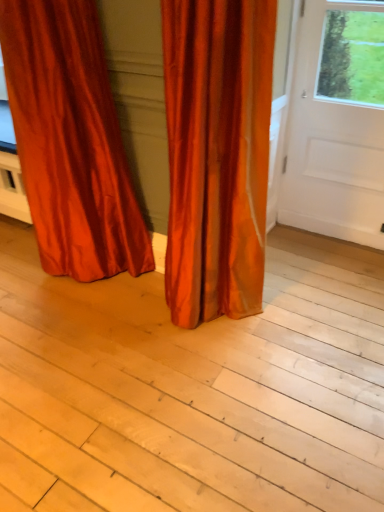
Identify the location of satin orange curtain at lower left, which ranks as the 1th curtain in left-to-right order. (71, 141).

What do you see at coordinates (191, 390) in the screenshot? The width and height of the screenshot is (384, 512). I see `light wood plank at center` at bounding box center [191, 390].

The height and width of the screenshot is (512, 384). What do you see at coordinates (217, 154) in the screenshot? I see `satin orange curtain at center, which is the 2th curtain from left to right` at bounding box center [217, 154].

I want to click on satin orange curtain at lower left, which appears as the 2th curtain when viewed from the right, so click(x=71, y=141).

Would you consider white smooth door at right to be distant from satin orange curtain at center, which is the 2th curtain from left to right?

white smooth door at right is actually quite close to satin orange curtain at center, which is the 2th curtain from left to right.

Is white smooth door at right facing away from satin orange curtain at center, which is the 2th curtain from left to right?

No, white smooth door at right is not facing away from satin orange curtain at center, which is the 2th curtain from left to right.

From the image's perspective, who appears lower, white smooth door at right or satin orange curtain at center, which is the 2th curtain from left to right?

From the image's view, satin orange curtain at center, which is the 2th curtain from left to right, is below.

Does point (280, 209) appear closer or farther from the camera than point (245, 105)?

Point (280, 209) is farther from the camera than point (245, 105).

From the image's perspective, would you say light wood plank at center is positioned over white smooth door at right?

Incorrect, from the image's perspective, light wood plank at center is lower than white smooth door at right.

Is point (5, 454) closer to viewer compared to point (372, 208)?

Yes, point (5, 454) is closer to viewer.

Who is bigger, light wood plank at center or white smooth door at right?

light wood plank at center is bigger.

Can you confirm if light wood plank at center is positioned to the right of white smooth door at right?

In fact, light wood plank at center is to the left of white smooth door at right.

Is satin orange curtain at center, the first curtain viewed from the right, looking in the opposite direction of satin orange curtain at lower left, which ranks as the 1th curtain in left-to-right order?

No, satin orange curtain at center, the first curtain viewed from the right, is not facing the opposite direction of satin orange curtain at lower left, which ranks as the 1th curtain in left-to-right order.

Which is nearer, (x=210, y=2) or (x=27, y=37)?

Point (x=210, y=2)

Identify the location of curtain below the satin orange curtain at lower left, which appears as the 2th curtain when viewed from the right (from a real-world perspective). (217, 154).

Measure the distance between light wood plank at center and satin orange curtain at lower left, which ranks as the 1th curtain in left-to-right order.

light wood plank at center is 26.49 inches from satin orange curtain at lower left, which ranks as the 1th curtain in left-to-right order.

Relative to satin orange curtain at lower left, which appears as the 2th curtain when viewed from the right, is light wood plank at center in front or behind?

In the image, light wood plank at center appears in front of satin orange curtain at lower left, which appears as the 2th curtain when viewed from the right.

From a real-world perspective, who is located lower, light wood plank at center or satin orange curtain at lower left, which ranks as the 1th curtain in left-to-right order?

Answer: light wood plank at center, from a real-world perspective.

Is point (328, 276) closer or farther from the camera than point (81, 9)?

Point (328, 276) appears to be farther away from the viewer than point (81, 9).

Considering the sizes of objects white smooth door at right and satin orange curtain at lower left, which appears as the 2th curtain when viewed from the right, in the image provided, who is shorter, white smooth door at right or satin orange curtain at lower left, which appears as the 2th curtain when viewed from the right,?

Standing shorter between the two is white smooth door at right.

Is white smooth door at right turned away from satin orange curtain at lower left, which appears as the 2th curtain when viewed from the right?

No, white smooth door at right is not facing the opposite direction of satin orange curtain at lower left, which appears as the 2th curtain when viewed from the right.

Does white smooth door at right lie in front of satin orange curtain at lower left, which ranks as the 1th curtain in left-to-right order?

No, white smooth door at right is further to the viewer.

Is white smooth door at right bigger or smaller than satin orange curtain at lower left, which appears as the 2th curtain when viewed from the right?

Considering their sizes, white smooth door at right takes up less space than satin orange curtain at lower left, which appears as the 2th curtain when viewed from the right.

Which object is positioned more to the right, satin orange curtain at lower left, which appears as the 2th curtain when viewed from the right, or satin orange curtain at center, which is the 2th curtain from left to right?

satin orange curtain at center, which is the 2th curtain from left to right, is more to the right.

Considering the sizes of satin orange curtain at lower left, which ranks as the 1th curtain in left-to-right order, and satin orange curtain at center, which is the 2th curtain from left to right, in the image, is satin orange curtain at lower left, which ranks as the 1th curtain in left-to-right order, wider or thinner than satin orange curtain at center, which is the 2th curtain from left to right,?

Clearly, satin orange curtain at lower left, which ranks as the 1th curtain in left-to-right order, has more width compared to satin orange curtain at center, which is the 2th curtain from left to right.

From the image's perspective, is satin orange curtain at lower left, which appears as the 2th curtain when viewed from the right, below satin orange curtain at center, the first curtain viewed from the right?

Incorrect, from the image's perspective, satin orange curtain at lower left, which appears as the 2th curtain when viewed from the right, is higher than satin orange curtain at center, the first curtain viewed from the right.

Can you confirm if satin orange curtain at lower left, which appears as the 2th curtain when viewed from the right, is thinner than light wood plank at center?

Yes, satin orange curtain at lower left, which appears as the 2th curtain when viewed from the right, is thinner than light wood plank at center.

Is satin orange curtain at lower left, which appears as the 2th curtain when viewed from the right, positioned with its back to light wood plank at center?

No, satin orange curtain at lower left, which appears as the 2th curtain when viewed from the right, is not facing the opposite direction of light wood plank at center.

Is satin orange curtain at lower left, which appears as the 2th curtain when viewed from the right, not within light wood plank at center?

satin orange curtain at lower left, which appears as the 2th curtain when viewed from the right, lies outside light wood plank at center's area.

The height and width of the screenshot is (512, 384). In order to click on door behind the satin orange curtain at center, the first curtain viewed from the right in this screenshot , I will do `click(337, 123)`.

Locate an element on the screen. This screenshot has width=384, height=512. door above the light wood plank at center (from a real-world perspective) is located at coordinates (337, 123).

When comparing their distances from satin orange curtain at lower left, which appears as the 2th curtain when viewed from the right, does light wood plank at center or white smooth door at right seem further?

white smooth door at right.

Estimate the real-world distances between objects in this image. Which object is closer to white smooth door at right, light wood plank at center or satin orange curtain at lower left, which ranks as the 1th curtain in left-to-right order?

Based on the image, light wood plank at center appears to be nearer to white smooth door at right.

When comparing their distances from satin orange curtain at center, the first curtain viewed from the right, does light wood plank at center or white smooth door at right seem further?

Based on the image, white smooth door at right appears to be further to satin orange curtain at center, the first curtain viewed from the right.

Which object lies further to the anchor point satin orange curtain at center, the first curtain viewed from the right, satin orange curtain at lower left, which appears as the 2th curtain when viewed from the right, or light wood plank at center?

Based on the image, light wood plank at center appears to be further to satin orange curtain at center, the first curtain viewed from the right.

Estimate the real-world distances between objects in this image. Which object is further from satin orange curtain at lower left, which appears as the 2th curtain when viewed from the right, satin orange curtain at center, which is the 2th curtain from left to right, or light wood plank at center?

Among the two, light wood plank at center is located further to satin orange curtain at lower left, which appears as the 2th curtain when viewed from the right.

Based on their spatial positions, is white smooth door at right or light wood plank at center closer to satin orange curtain at lower left, which ranks as the 1th curtain in left-to-right order?

light wood plank at center is closer to satin orange curtain at lower left, which ranks as the 1th curtain in left-to-right order.

When comparing their distances from white smooth door at right, does satin orange curtain at lower left, which appears as the 2th curtain when viewed from the right, or light wood plank at center seem further?

satin orange curtain at lower left, which appears as the 2th curtain when viewed from the right, is further to white smooth door at right.

Considering their positions, is satin orange curtain at center, the first curtain viewed from the right, positioned further to satin orange curtain at lower left, which appears as the 2th curtain when viewed from the right, than white smooth door at right?

white smooth door at right is further to satin orange curtain at lower left, which appears as the 2th curtain when viewed from the right.

The width and height of the screenshot is (384, 512). I want to click on plank between satin orange curtain at lower left, which appears as the 2th curtain when viewed from the right, and white smooth door at right, so click(x=191, y=390).

You are a GUI agent. You are given a task and a screenshot of the screen. Output one action in this format:
    pyautogui.click(x=<x>, y=<y>)
    Task: Click on the curtain situated between light wood plank at center and white smooth door at right from left to right
    Image resolution: width=384 pixels, height=512 pixels.
    Given the screenshot: What is the action you would take?
    pyautogui.click(x=217, y=154)

The image size is (384, 512). Identify the location of curtain between satin orange curtain at lower left, which ranks as the 1th curtain in left-to-right order, and white smooth door at right from left to right. (217, 154).

In order to click on curtain between satin orange curtain at lower left, which ranks as the 1th curtain in left-to-right order, and light wood plank at center vertically in this screenshot , I will do `click(217, 154)`.